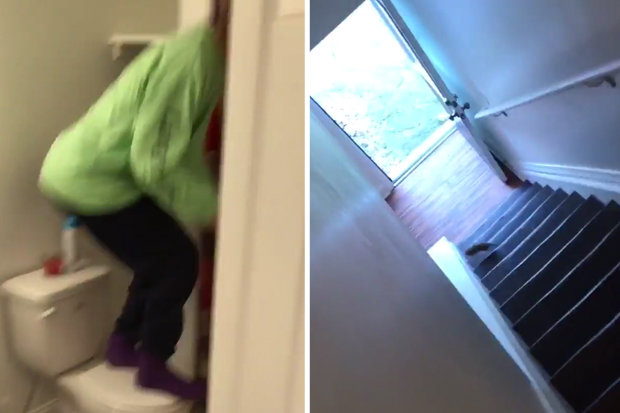
At what (x,y) coordinates should I click in order to perform the action: click on toilet handle. Please return your answer as a coordinate pair (x, y). This screenshot has height=413, width=620. Looking at the image, I should click on (50, 315).